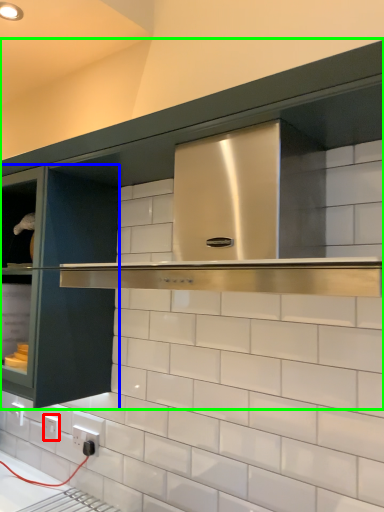
Question: Which is farther away from electric outlet (highlighted by a red box)? glass door (highlighted by a blue box) or cabinetry (highlighted by a green box)?

Choices:
 (A) glass door
 (B) cabinetry

Answer: (B)